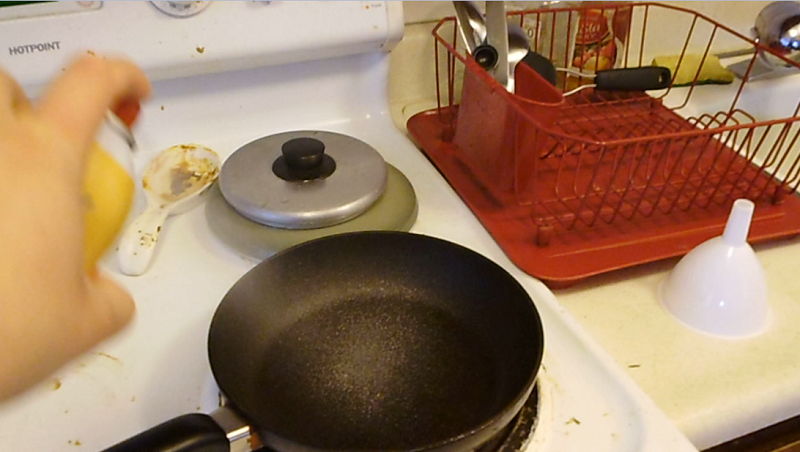
This screenshot has height=452, width=800. What are the coordinates of `wall` in the screenshot? It's located at (670, 29).